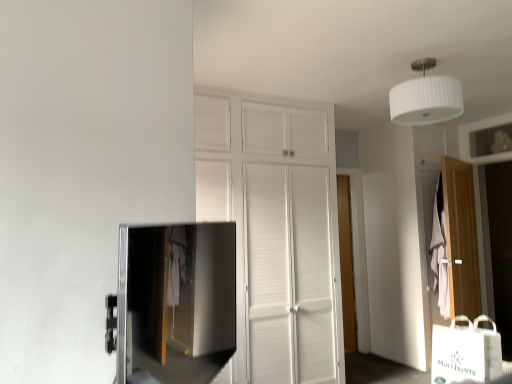
At what (x,y) coordinates should I click in order to perform the action: click on blank space above white ribbed shade at upper center (from a real-world perspective). Please return your answer as a coordinate pair (x, y). Looking at the image, I should click on (429, 61).